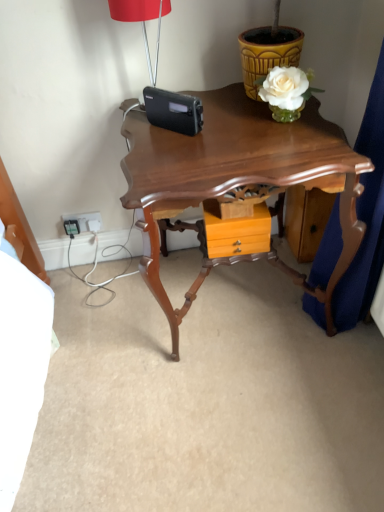
Question: Does white plastic electrical outlet at lower left have a smaller size compared to orange wood drawer at center?

Choices:
 (A) yes
 (B) no

Answer: (A)

Question: Is white plastic electrical outlet at lower left oriented towards orange wood drawer at center?

Choices:
 (A) yes
 (B) no

Answer: (B)

Question: Does white plastic electrical outlet at lower left have a lesser width compared to orange wood drawer at center?

Choices:
 (A) yes
 (B) no

Answer: (A)

Question: Does white plastic electrical outlet at lower left have a greater height compared to orange wood drawer at center?

Choices:
 (A) yes
 (B) no

Answer: (B)

Question: From a real-world perspective, is white plastic electrical outlet at lower left positioned over orange wood drawer at center based on gravity?

Choices:
 (A) no
 (B) yes

Answer: (A)

Question: Is orange wood drawer at center inside or outside of shiny brown wooden table at center?

Choices:
 (A) inside
 (B) outside

Answer: (A)

Question: Considering the positions of orange wood drawer at center and shiny brown wooden table at center in the image, is orange wood drawer at center taller or shorter than shiny brown wooden table at center?

Choices:
 (A) tall
 (B) short

Answer: (B)

Question: Considering the positions of orange wood drawer at center and shiny brown wooden table at center in the image, is orange wood drawer at center wider or thinner than shiny brown wooden table at center?

Choices:
 (A) thin
 (B) wide

Answer: (A)

Question: Is orange wood drawer at center to the left or to the right of shiny brown wooden table at center in the image?

Choices:
 (A) right
 (B) left

Answer: (A)

Question: From a real-world perspective, relative to yellow textured flowerpot at upper right, is white plastic electrical outlet at lower left vertically above or below?

Choices:
 (A) above
 (B) below

Answer: (B)

Question: From the image's perspective, is white plastic electrical outlet at lower left located above or below yellow textured flowerpot at upper right?

Choices:
 (A) below
 (B) above

Answer: (A)

Question: In the image, is white plastic electrical outlet at lower left on the left side or the right side of yellow textured flowerpot at upper right?

Choices:
 (A) right
 (B) left

Answer: (B)

Question: Is white plastic electrical outlet at lower left in front of or behind yellow textured flowerpot at upper right in the image?

Choices:
 (A) front
 (B) behind

Answer: (B)

Question: In the image, is yellow textured flowerpot at upper right positioned in front of or behind shiny brown wooden table at center?

Choices:
 (A) behind
 (B) front

Answer: (A)

Question: Looking at their shapes, would you say yellow textured flowerpot at upper right is wider or thinner than shiny brown wooden table at center?

Choices:
 (A) thin
 (B) wide

Answer: (A)